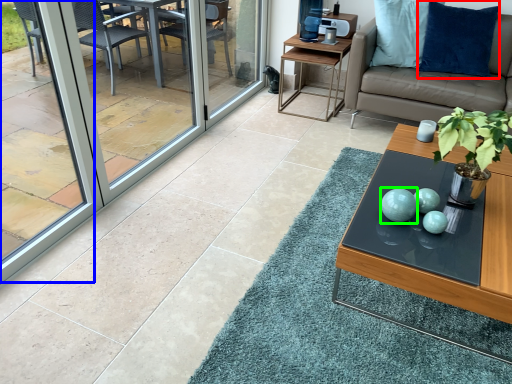
Question: Which object is positioned farthest from pillow (highlighted by a red box)? Select from window screen (highlighted by a blue box) and turquoise (highlighted by a green box).

Choices:
 (A) window screen
 (B) turquoise

Answer: (A)